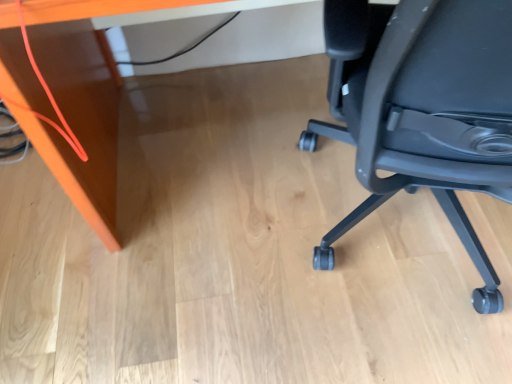
Question: Does point (192, 0) appear closer or farther from the camera than point (510, 72)?

Choices:
 (A) closer
 (B) farther

Answer: (A)

Question: Do you think matte orange desk at upper left is within black plastic chair at right, or outside of it?

Choices:
 (A) outside
 (B) inside

Answer: (A)

Question: Looking at the image, does matte orange desk at upper left seem bigger or smaller compared to black plastic chair at right?

Choices:
 (A) big
 (B) small

Answer: (A)

Question: Is point (445, 158) positioned closer to the camera than point (31, 99)?

Choices:
 (A) farther
 (B) closer

Answer: (A)

Question: Is black plastic chair at right situated inside matte orange desk at upper left or outside?

Choices:
 (A) outside
 (B) inside

Answer: (A)

Question: Is black plastic chair at right bigger or smaller than matte orange desk at upper left?

Choices:
 (A) big
 (B) small

Answer: (B)

Question: Considering their positions, is black plastic chair at right located in front of or behind matte orange desk at upper left?

Choices:
 (A) front
 (B) behind

Answer: (A)